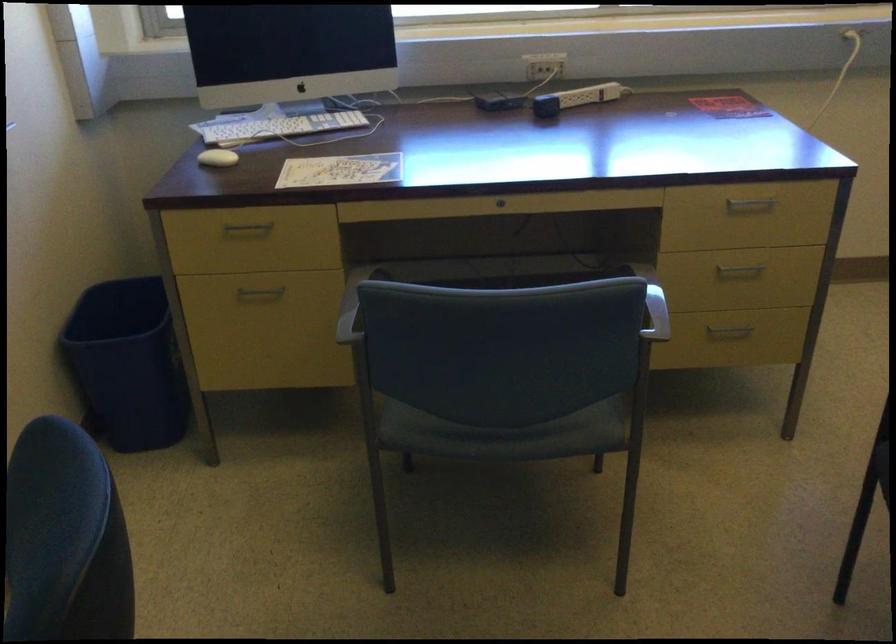
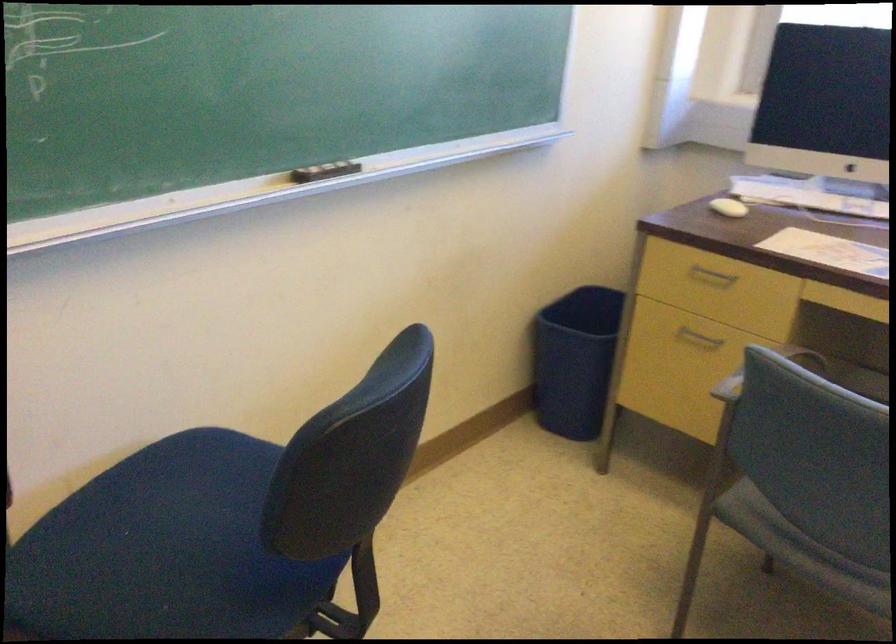
Question: The images are taken continuously from a first-person perspective. In which direction is your viewpoint rotating?

Choices:
 (A) Left
 (B) Right
 (C) Up
 (D) Down

Answer: (A)